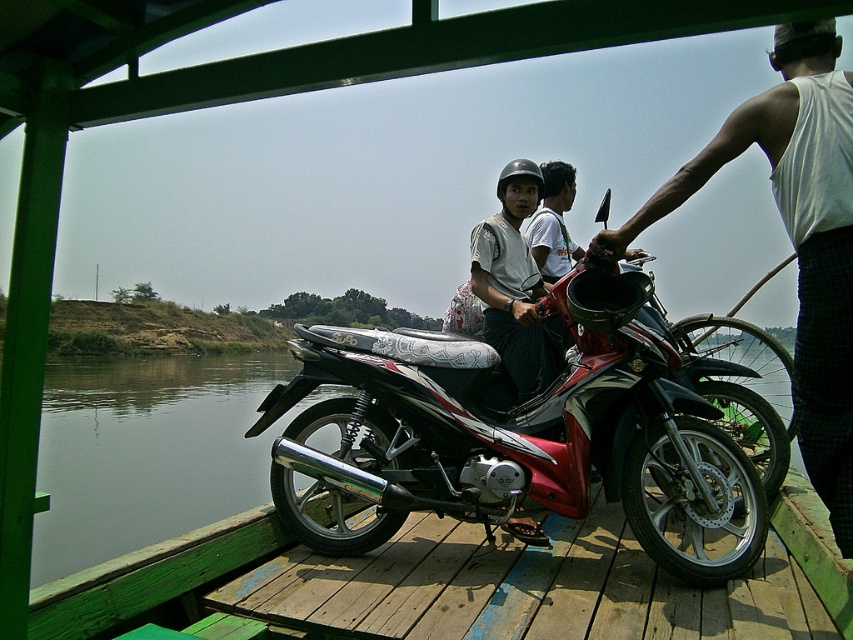
You are a photographer positioned on the wooden platform and want to capture a photo that includes both the white tank top at right and the matte white shirt at center. Which clothing item should you focus on first to ensure both are in frame?

The white tank top at right is located below the matte white shirt at center. To include both in the frame, focus on the matte white shirt at center first as it is higher up, then adjust the camera angle downward to include the white tank top at right.

Looking at this image, you are a photographer standing on the wooden platform. You want to take a photo of the shiny red motorcycle at center without any people blocking it. Is the matte white shirt at center currently blocking the motorcycle?

The shiny red motorcycle at center is positioned under matte white shirt at center, so the shirt is blocking the motorcycle. Move the matte white shirt at center out of the way to get an unobstructed view.